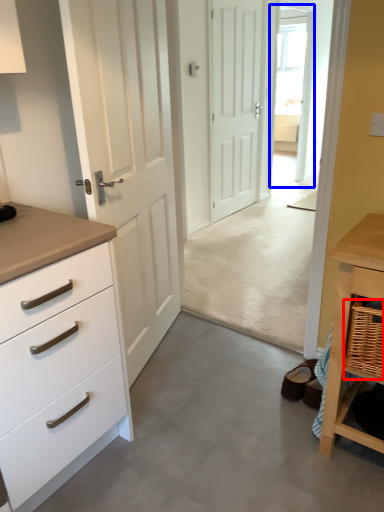
Question: Which object is closer to the camera taking this photo, basket (highlighted by a red box) or glass door (highlighted by a blue box)?

Choices:
 (A) basket
 (B) glass door

Answer: (A)